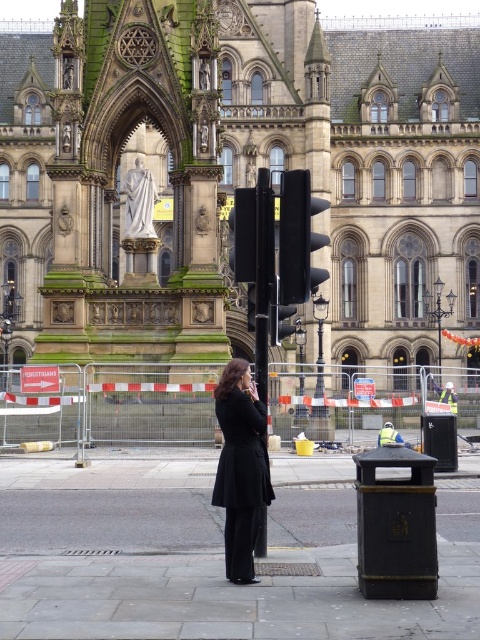
Question: Can you confirm if black matte traffic light at center is smaller than black glass traffic light at center?

Choices:
 (A) no
 (B) yes

Answer: (A)

Question: Which is nearer to the black glossy pole at center?

Choices:
 (A) black matte traffic light at center
 (B) black glass traffic light at center
 (C) black wool coat at center

Answer: (A)

Question: Considering the real-world distances, which object is closest to the black matte traffic light at center?

Choices:
 (A) black glossy pole at center
 (B) black glass traffic light at center
 (C) black wool coat at center

Answer: (A)

Question: Which of these objects is positioned closest to the black glossy pole at center?

Choices:
 (A) black glass traffic light at center
 (B) black matte traffic light at center

Answer: (B)

Question: Can you confirm if black matte traffic light at center is positioned above black glossy pole at center?

Choices:
 (A) no
 (B) yes

Answer: (B)

Question: Is black wool coat at center below black glossy pole at center?

Choices:
 (A) yes
 (B) no

Answer: (A)